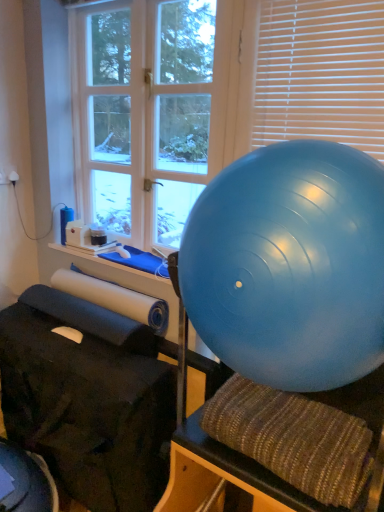
Question: Is blue rubber ball at right bigger than textured brown bean bag chair at center?

Choices:
 (A) yes
 (B) no

Answer: (A)

Question: Is blue rubber ball at right with textured brown bean bag chair at center?

Choices:
 (A) yes
 (B) no

Answer: (B)

Question: Is blue rubber ball at right smaller than textured brown bean bag chair at center?

Choices:
 (A) no
 (B) yes

Answer: (A)

Question: From the image's perspective, does blue rubber ball at right appear higher than textured brown bean bag chair at center?

Choices:
 (A) no
 (B) yes

Answer: (B)

Question: Is blue rubber ball at right facing towards textured brown bean bag chair at center?

Choices:
 (A) yes
 (B) no

Answer: (B)

Question: Considering the relative positions of blue rubber ball at right and textured brown bean bag chair at center in the image provided, is blue rubber ball at right to the left of textured brown bean bag chair at center from the viewer's perspective?

Choices:
 (A) yes
 (B) no

Answer: (B)

Question: Is white wood window at upper left at the left side of white plastic blinds at upper right?

Choices:
 (A) yes
 (B) no

Answer: (A)

Question: Is white wood window at upper left wider than white plastic blinds at upper right?

Choices:
 (A) no
 (B) yes

Answer: (B)

Question: Considering the relative positions of white wood window at upper left and white plastic blinds at upper right in the image provided, is white wood window at upper left to the right of white plastic blinds at upper right from the viewer's perspective?

Choices:
 (A) yes
 (B) no

Answer: (B)

Question: From the image's perspective, does white wood window at upper left appear higher than white plastic blinds at upper right?

Choices:
 (A) no
 (B) yes

Answer: (B)

Question: Is white wood window at upper left positioned beyond the bounds of white plastic blinds at upper right?

Choices:
 (A) yes
 (B) no

Answer: (A)

Question: Is white wood window at upper left smaller than white plastic blinds at upper right?

Choices:
 (A) no
 (B) yes

Answer: (A)

Question: Is white plastic blinds at upper right smaller than white wood window at upper left?

Choices:
 (A) yes
 (B) no

Answer: (A)